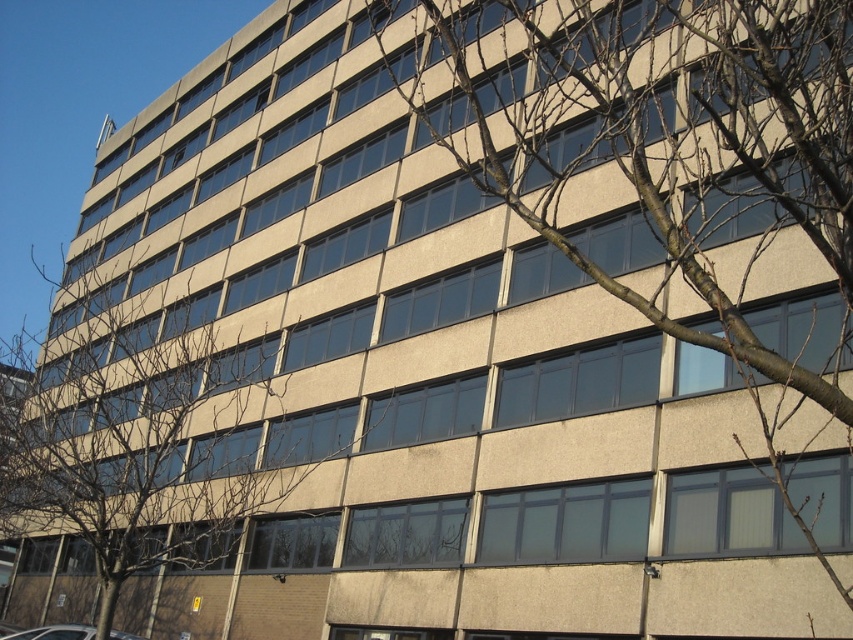
Looking at this image, you are standing in front of the gray concrete building at center. If you want to take a photo of the entire building without moving your camera, will you need to zoom in or zoom out?

The gray concrete building at center is 5.79 meters from camera. Since the building is at a moderate distance from the camera, you would likely need to zoom out slightly to ensure the entire building fits within the frame.

You are standing in front of the multi story building with modern architecture. You notice a point marked at coordinates [669,147]. Based on the scene description, can you determine what surface this point is located on?

The point [669,147] is on the gray concrete building at center.